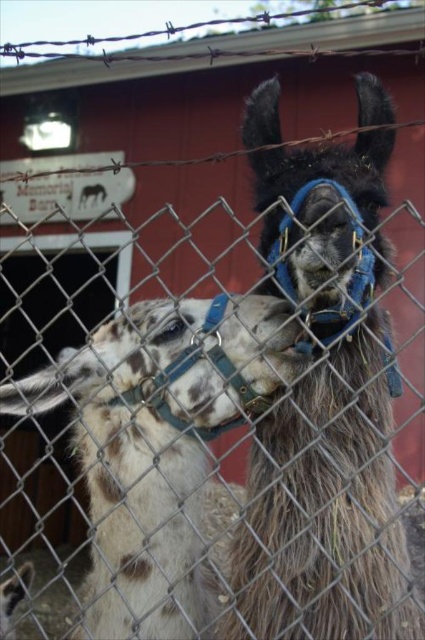
Question: Which point appears farthest from the camera in this image?

Choices:
 (A) (170, 440)
 (B) (357, 83)

Answer: (B)

Question: Is dark brown woolen alpaca at center behind speckled wool alpaca at left?

Choices:
 (A) no
 (B) yes

Answer: (A)

Question: Observing the image, what is the correct spatial positioning of dark brown woolen alpaca at center in reference to speckled wool alpaca at left?

Choices:
 (A) below
 (B) above

Answer: (B)

Question: Does dark brown woolen alpaca at center appear on the right side of speckled wool alpaca at left?

Choices:
 (A) no
 (B) yes

Answer: (B)

Question: Among these points, which one is farthest from the camera?

Choices:
 (A) (377, 572)
 (B) (147, 557)

Answer: (B)